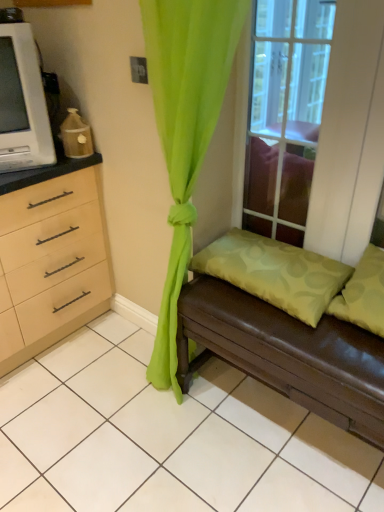
Question: Is green fabric pillow at lower right, which is the 1th pillow from left to right, bigger than green sheer curtain at center?

Choices:
 (A) yes
 (B) no

Answer: (B)

Question: Is green fabric pillow at lower right, the 2th pillow when ordered from right to left, far from green sheer curtain at center?

Choices:
 (A) no
 (B) yes

Answer: (A)

Question: Are green fabric pillow at lower right, which is the 1th pillow from left to right, and green sheer curtain at center making contact?

Choices:
 (A) no
 (B) yes

Answer: (A)

Question: From the image's perspective, does green fabric pillow at lower right, the 2th pillow when ordered from right to left, appear lower than green sheer curtain at center?

Choices:
 (A) no
 (B) yes

Answer: (B)

Question: Is green fabric pillow at lower right, which is the 1th pillow from left to right, in front of green sheer curtain at center?

Choices:
 (A) yes
 (B) no

Answer: (B)

Question: Is green sheer curtain at center taller or shorter than clear glass window at upper center?

Choices:
 (A) tall
 (B) short

Answer: (A)

Question: Is green sheer curtain at center to the left or to the right of clear glass window at upper center in the image?

Choices:
 (A) right
 (B) left

Answer: (B)

Question: From the image's perspective, is green sheer curtain at center positioned above or below clear glass window at upper center?

Choices:
 (A) below
 (B) above

Answer: (A)

Question: Is green sheer curtain at center spatially inside clear glass window at upper center, or outside of it?

Choices:
 (A) outside
 (B) inside

Answer: (A)

Question: From the image's perspective, is clear glass window at upper center above or below white plastic microwave at left?

Choices:
 (A) above
 (B) below

Answer: (B)

Question: Is clear glass window at upper center in front of or behind white plastic microwave at left in the image?

Choices:
 (A) behind
 (B) front

Answer: (B)

Question: From a real-world perspective, is clear glass window at upper center physically located above or below white plastic microwave at left?

Choices:
 (A) above
 (B) below

Answer: (B)

Question: From their relative heights in the image, would you say clear glass window at upper center is taller or shorter than white plastic microwave at left?

Choices:
 (A) tall
 (B) short

Answer: (A)

Question: Considering the positions of green sheer curtain at center and brown leather studio couch at lower right in the image, is green sheer curtain at center wider or thinner than brown leather studio couch at lower right?

Choices:
 (A) thin
 (B) wide

Answer: (A)

Question: Is green sheer curtain at center in front of or behind brown leather studio couch at lower right in the image?

Choices:
 (A) front
 (B) behind

Answer: (A)